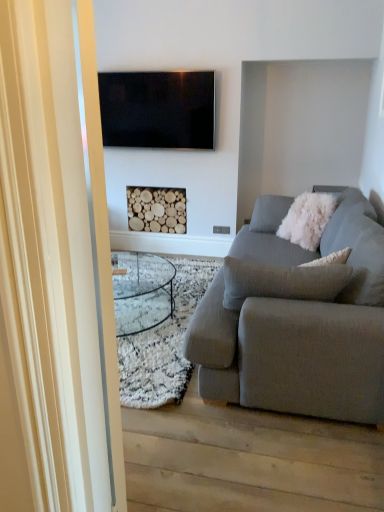
Question: Should I look upward or downward to see transparent glass door at left?

Choices:
 (A) down
 (B) up

Answer: (A)

Question: Is textured gray couch at right next to flat screen tv at upper center and touching it?

Choices:
 (A) yes
 (B) no

Answer: (B)

Question: Are textured gray couch at right and flat screen tv at upper center located far from each other?

Choices:
 (A) yes
 (B) no

Answer: (A)

Question: Does textured gray couch at right come behind flat screen tv at upper center?

Choices:
 (A) yes
 (B) no

Answer: (B)

Question: From a real-world perspective, is textured gray couch at right on top of flat screen tv at upper center?

Choices:
 (A) no
 (B) yes

Answer: (A)

Question: Considering the relative sizes of textured gray couch at right and flat screen tv at upper center in the image provided, is textured gray couch at right smaller than flat screen tv at upper center?

Choices:
 (A) yes
 (B) no

Answer: (B)

Question: From a real-world perspective, is textured gray couch at right located beneath flat screen tv at upper center?

Choices:
 (A) yes
 (B) no

Answer: (A)

Question: Is wooden logs at center further to camera compared to textured gray couch at right?

Choices:
 (A) yes
 (B) no

Answer: (A)

Question: Can you confirm if wooden logs at center is bigger than textured gray couch at right?

Choices:
 (A) no
 (B) yes

Answer: (A)

Question: Can you confirm if wooden logs at center is taller than textured gray couch at right?

Choices:
 (A) no
 (B) yes

Answer: (A)

Question: Is wooden logs at center facing towards textured gray couch at right?

Choices:
 (A) yes
 (B) no

Answer: (B)

Question: Is wooden logs at center outside textured gray couch at right?

Choices:
 (A) yes
 (B) no

Answer: (A)

Question: From the image's perspective, does wooden logs at center appear lower than textured gray couch at right?

Choices:
 (A) no
 (B) yes

Answer: (A)

Question: Is textured gray couch at right at the left side of transparent glass door at left?

Choices:
 (A) no
 (B) yes

Answer: (A)